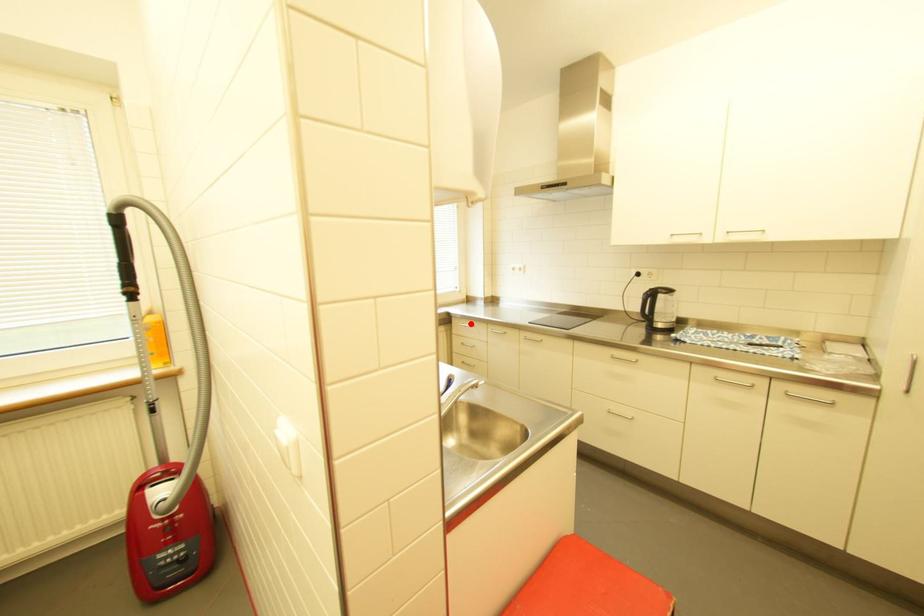
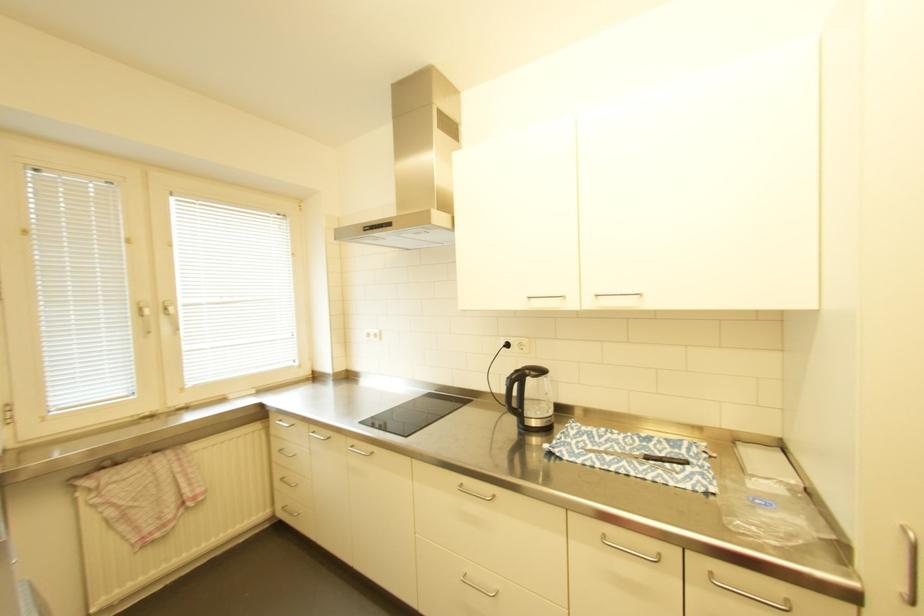
Question: I am providing you with two images of the same scene from different viewpoints. A red point is marked on the first image. Can you still see the location of the red point in image 2?

Choices:
 (A) Yes
 (B) No

Answer: (A)